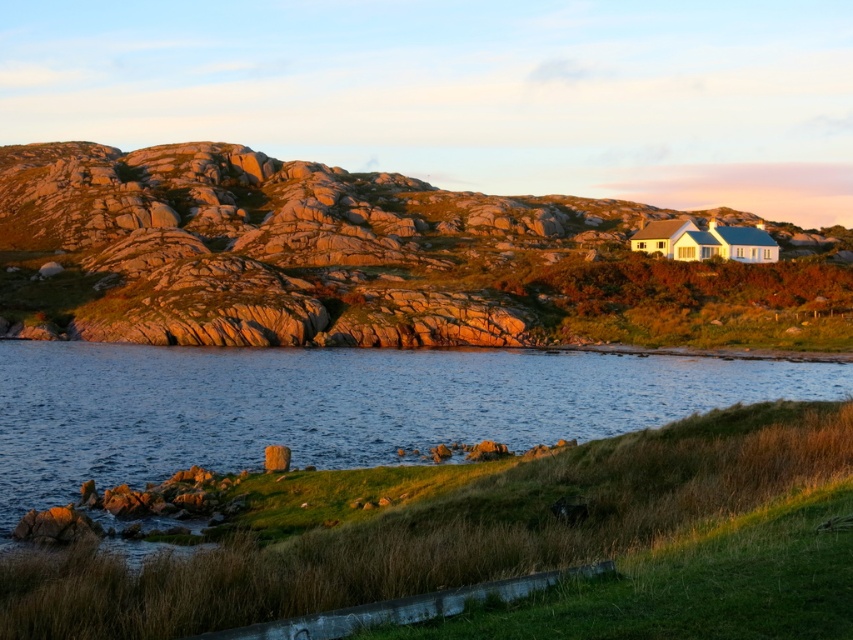
Question: Which object is positioned farthest from the smooth gray rock at lower left?

Choices:
 (A) blue water at center
 (B) rough stone hillside at upper center

Answer: (B)

Question: Which point appears closest to the camera in this image?

Choices:
 (A) (177, 412)
 (B) (288, 464)
 (C) (376, 323)

Answer: (B)

Question: Can you confirm if rough stone hillside at upper center is thinner than smooth gray rock at lower left?

Choices:
 (A) yes
 (B) no

Answer: (B)

Question: Among these objects, which one is nearest to the camera?

Choices:
 (A) rough stone hillside at upper center
 (B) blue water at center
 (C) smooth gray rock at lower left

Answer: (B)

Question: Does rough stone hillside at upper center appear under smooth gray rock at lower left?

Choices:
 (A) yes
 (B) no

Answer: (B)

Question: In this image, where is blue water at center located relative to smooth gray rock at lower left?

Choices:
 (A) right
 (B) left

Answer: (B)